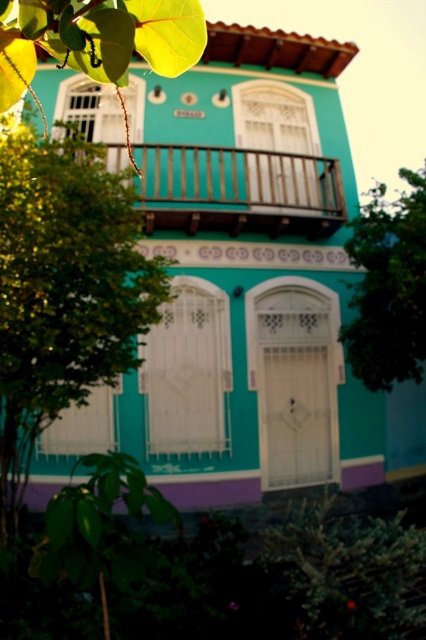
You are standing in front of the two story building and want to take a photo of the purple base at the bottom. The green leafy tree at left is blocking your view. What should you do to avoid the obstruction?

Move to the right side of the green leafy tree at left to get an unobstructed view of the purple base at the bottom.

You are standing in front of the turquoise building and want to take a photo that includes both the green leafy tree at upper right and the green leafy tree at lower left. Which tree should you move closer to in order to capture both in the frame?

To capture both the green leafy tree at upper right and the green leafy tree at lower left in the frame, you should move closer to the green leafy tree at lower left since the green leafy tree at upper right is positioned on the right side of it, allowing both to be included when centered on the left tree.